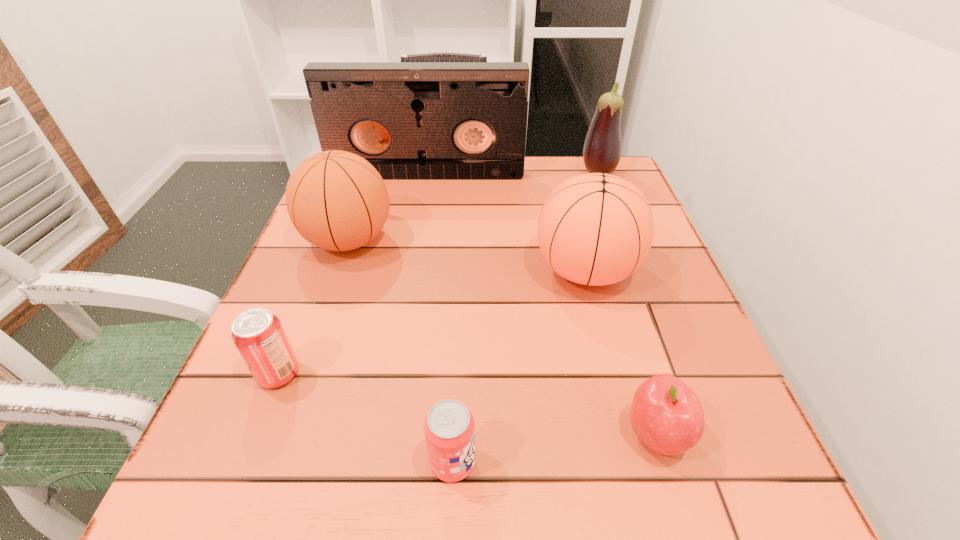
I want to click on vacant space at the left edge of the desktop, so click(x=332, y=352).

Find the location of a particular element. vacant space at the right edge of the desktop is located at coordinates (707, 342).

Locate an element on the screen. vacant space at the near left corner is located at coordinates (245, 465).

You are a GUI agent. You are given a task and a screenshot of the screen. Output one action in this format:
    pyautogui.click(x=<x>, y=<y>)
    Task: Click on the empty space that is in between the right soda can and the left basketball
    This screenshot has height=540, width=960.
    Given the screenshot: What is the action you would take?
    pyautogui.click(x=400, y=351)

Identify the location of vacant area between the apple and the nearer soda can. Image resolution: width=960 pixels, height=540 pixels. (554, 449).

In order to click on empty space between the apple and the left basketball in this screenshot , I will do [502, 338].

The width and height of the screenshot is (960, 540). Identify the location of unoccupied position between the left basketball and the left soda can. (314, 307).

Find the location of a particular element. The image size is (960, 540). free space between the videotape and the right soda can is located at coordinates (440, 319).

Identify the location of vacant point located between the nearer soda can and the left basketball. The width and height of the screenshot is (960, 540). (400, 351).

This screenshot has width=960, height=540. Find the location of `unoccupied area between the right basketball and the third nearest object`. unoccupied area between the right basketball and the third nearest object is located at coordinates (432, 322).